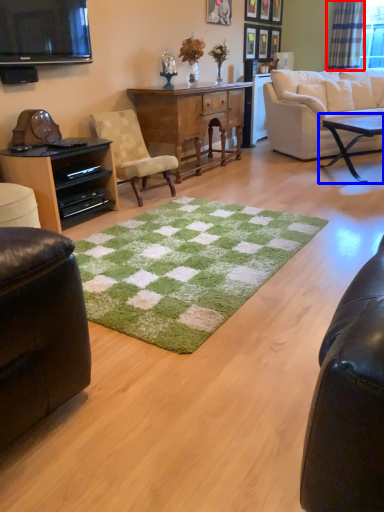
Question: Which of the following is the farthest to the observer, curtain (highlighted by a red box) or coffee table (highlighted by a blue box)?

Choices:
 (A) curtain
 (B) coffee table

Answer: (A)